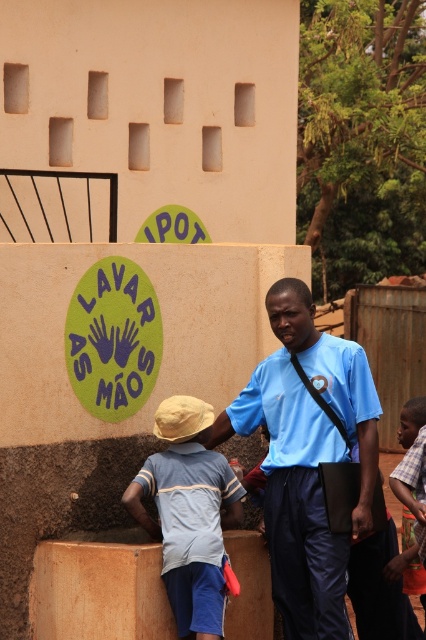
Is light blue fabric shirt at lower left shorter than plaid fabric shirt at right?

In fact, light blue fabric shirt at lower left may be taller than plaid fabric shirt at right.

This screenshot has width=426, height=640. Find the location of `light blue fabric shirt at lower left`. light blue fabric shirt at lower left is located at coordinates (189, 513).

Who is more distant from viewer, (319,388) or (155,476)?

The point (319,388) is more distant.

Find the location of a particular element. The width and height of the screenshot is (426, 640). blue fabric shirt at center is located at coordinates (307, 458).

Can you confirm if blue fabric shirt at center is bigger than plaid fabric shirt at right?

Correct, blue fabric shirt at center is larger in size than plaid fabric shirt at right.

This screenshot has height=640, width=426. In order to click on blue fabric shirt at center in this screenshot , I will do `click(307, 458)`.